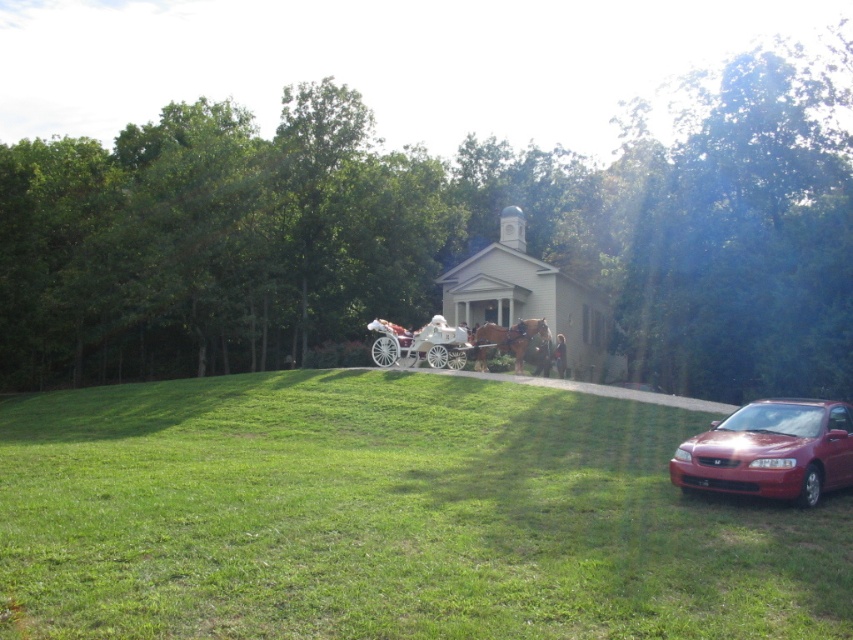
In the scene shown: Between green grassy at lower left and shiny red sedan at lower right, which one has more height?

Standing taller between the two is green grassy at lower left.

This screenshot has width=853, height=640. Find the location of `green grassy at lower left`. green grassy at lower left is located at coordinates (389, 516).

Between shiny red sedan at lower right and brown glossy horse at center, which one is positioned higher?

Positioned higher is brown glossy horse at center.

Who is more distant from viewer, (764, 419) or (479, 344)?

Positioned behind is point (479, 344).

Where is `shiny red sedan at lower right`? This screenshot has width=853, height=640. shiny red sedan at lower right is located at coordinates (770, 451).

Looking at this image, between green grassy at lower left and white glossy wagon at center, which one is positioned lower?

Positioned lower is green grassy at lower left.

Which is in front, point (51, 592) or point (409, 346)?

Positioned in front is point (51, 592).

You are a GUI agent. You are given a task and a screenshot of the screen. Output one action in this format:
    pyautogui.click(x=<x>, y=<y>)
    Task: Click on the green grassy at lower left
    The height and width of the screenshot is (640, 853).
    Given the screenshot: What is the action you would take?
    pyautogui.click(x=389, y=516)